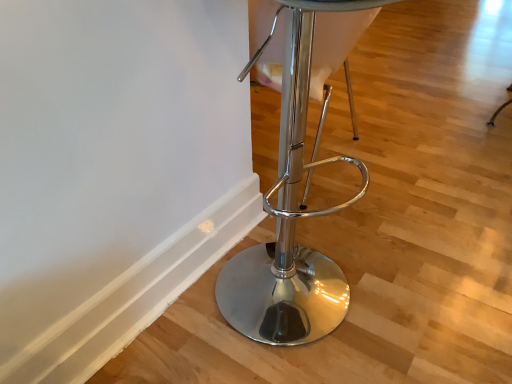
What do you see at coordinates (291, 219) in the screenshot? I see `chrome metallic stool at center` at bounding box center [291, 219].

This screenshot has width=512, height=384. I want to click on chrome metallic stool at center, so click(x=291, y=219).

Where is `chrome metallic stool at center`? chrome metallic stool at center is located at coordinates (291, 219).